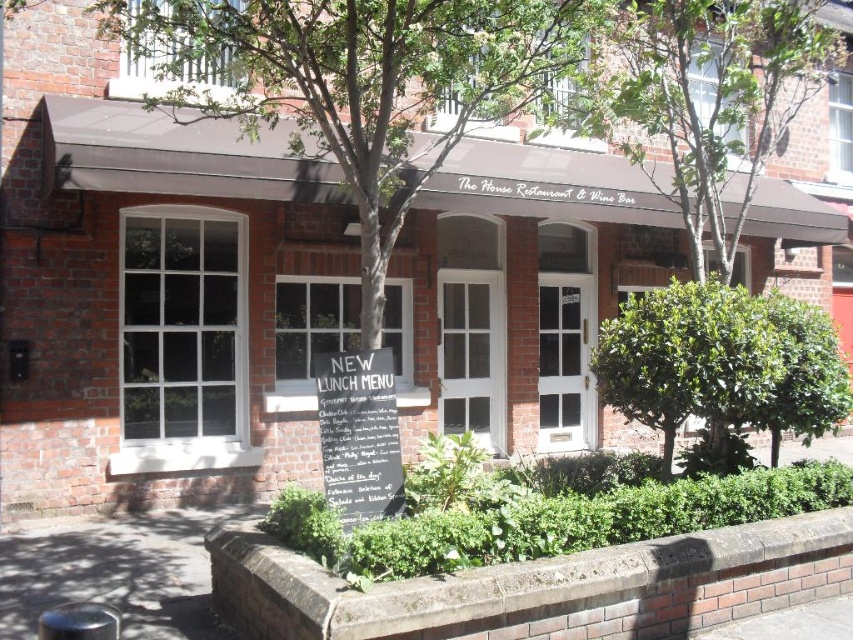
Is point (674, 436) farther from camera compared to point (363, 364)?

Yes, it is behind point (363, 364).

Can you confirm if green leafy bush at center is taller than white chalkboard sign at center?

Indeed, green leafy bush at center has a greater height compared to white chalkboard sign at center.

You are a GUI agent. You are given a task and a screenshot of the screen. Output one action in this format:
    pyautogui.click(x=<x>, y=<y>)
    Task: Click on the green leafy bush at center
    The image size is (853, 640).
    Given the screenshot: What is the action you would take?
    pyautogui.click(x=721, y=362)

Does green leafy bush at center have a lesser height compared to shiny metallic stool at lower left?

No, green leafy bush at center is not shorter than shiny metallic stool at lower left.

Is green leafy bush at center to the right of shiny metallic stool at lower left from the viewer's perspective?

Correct, you'll find green leafy bush at center to the right of shiny metallic stool at lower left.

Is point (711, 349) positioned behind point (88, 612)?

Yes, point (711, 349) is behind point (88, 612).

The width and height of the screenshot is (853, 640). In order to click on green leafy bush at center in this screenshot , I will do `click(721, 362)`.

Between white chalkboard sign at center and shiny metallic stool at lower left, which one is positioned lower?

shiny metallic stool at lower left is lower down.

The width and height of the screenshot is (853, 640). What do you see at coordinates (358, 435) in the screenshot? I see `white chalkboard sign at center` at bounding box center [358, 435].

At what (x,y) coordinates should I click in order to perform the action: click on white chalkboard sign at center. Please return your answer as a coordinate pair (x, y). Looking at the image, I should click on (358, 435).